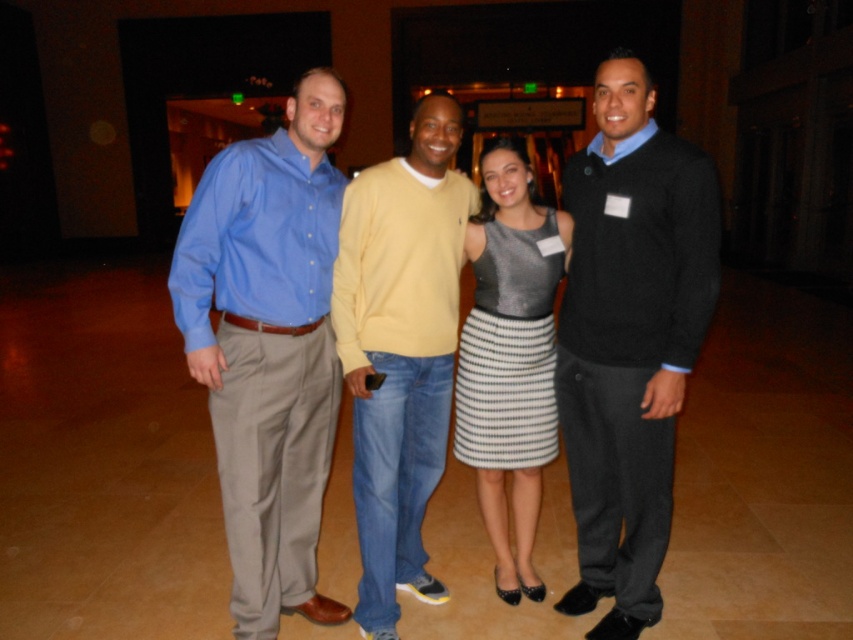
Question: Which object appears closest to the camera in this image?

Choices:
 (A) shiny metallic dress at center
 (B) matte black sweater at right

Answer: (B)

Question: Is light yellow sweater at center to the left of shiny metallic dress at center from the viewer's perspective?

Choices:
 (A) no
 (B) yes

Answer: (B)

Question: Which object is positioned farthest from the matte black sweater at right?

Choices:
 (A) shiny metallic dress at center
 (B) matte blue shirt at left

Answer: (B)

Question: Can you confirm if matte blue shirt at left is smaller than shiny metallic dress at center?

Choices:
 (A) no
 (B) yes

Answer: (A)

Question: In this image, where is matte blue shirt at left located relative to light yellow sweater at center?

Choices:
 (A) left
 (B) right

Answer: (A)

Question: Which point is closer to the camera?

Choices:
 (A) light yellow sweater at center
 (B) matte black sweater at right
 (C) shiny metallic dress at center

Answer: (B)